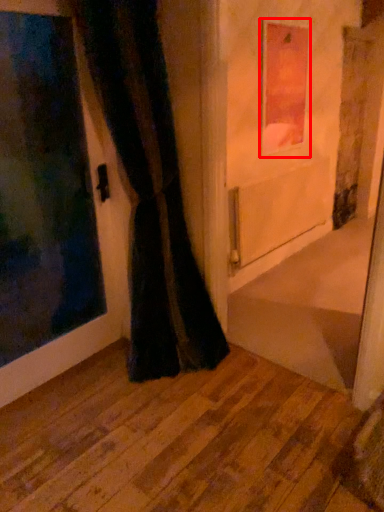
Question: From the image's perspective, what is the correct spatial relationship of picture frame (annotated by the red box) in relation to corridor?

Choices:
 (A) below
 (B) above

Answer: (B)